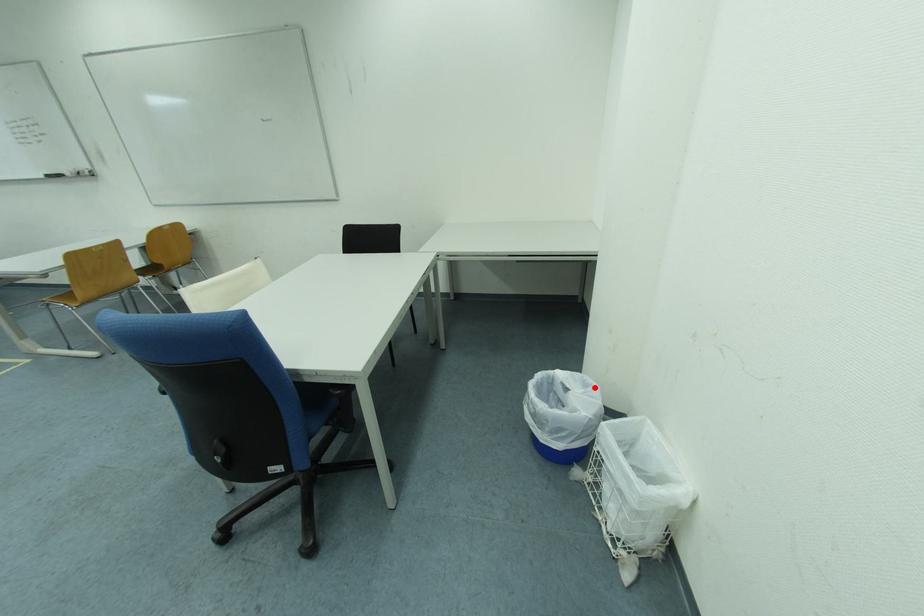
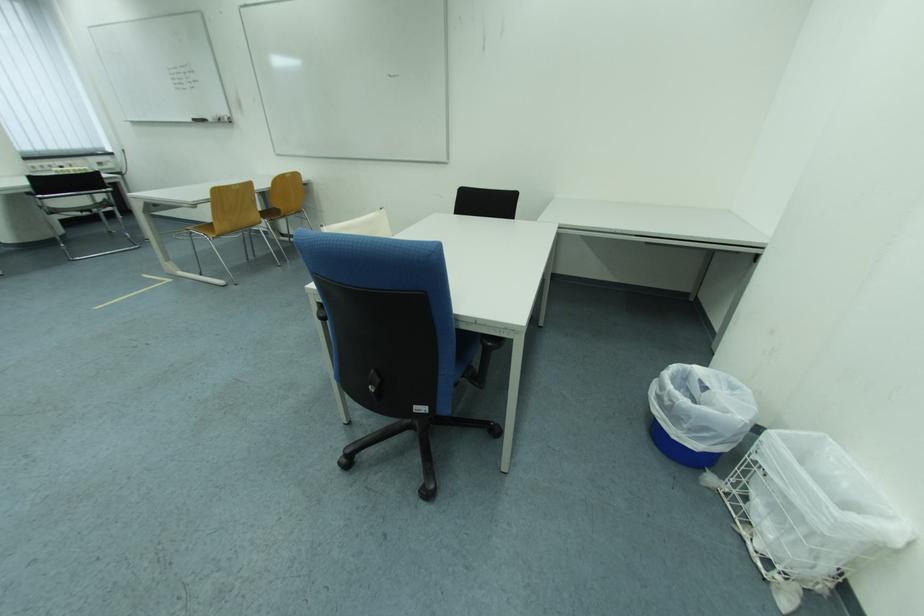
The point at the highlighted location is marked in the first image. Where is the corresponding point in the second image?

(742, 390)